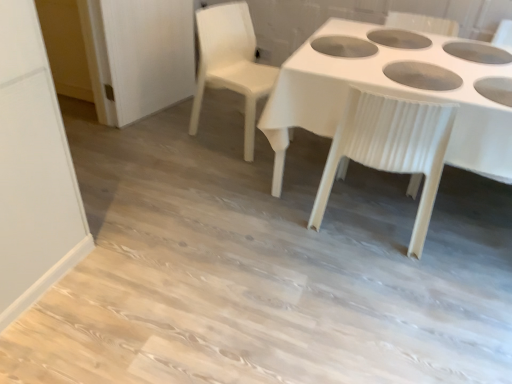
At what (x,y) coordinates should I click in order to perform the action: click on free space underneath white plastic chair at upper center, positioned as the second chair in right-to-left order (from a real-world perspective). Please return your answer as a coordinate pair (x, y). Looking at the image, I should click on (229, 132).